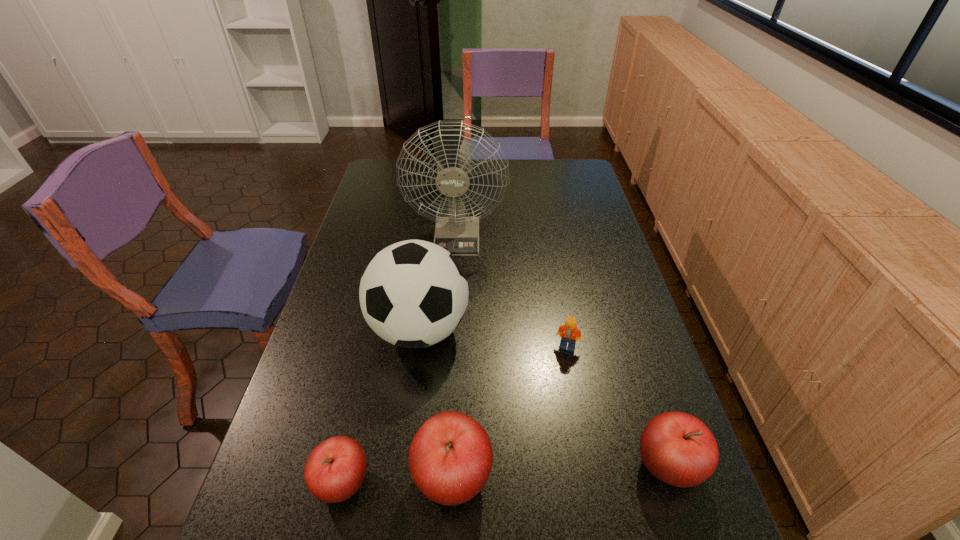
At what (x,y) coordinates should I click in order to perform the action: click on vacant point located between the soccer ball and the rightmost object. Please return your answer as a coordinate pair (x, y). Looking at the image, I should click on [543, 398].

Where is `free space between the second apple from left to right and the farthest object`? The image size is (960, 540). free space between the second apple from left to right and the farthest object is located at coordinates (455, 357).

Identify which object is the second nearest to the fifth shortest object. Please provide its 2D coordinates. Your answer should be formatted as a tuple, i.e. [(x, y)], where the tuple contains the x and y coordinates of a point satisfying the conditions above.

[(450, 458)]

I want to click on object that is the third nearest to the second tallest object, so coord(334,471).

I want to click on the second closest apple relative to the third shortest object, so click(x=334, y=471).

Select which apple appears as the third closest to the tallest object. Please provide its 2D coordinates. Your answer should be formatted as a tuple, i.e. [(x, y)], where the tuple contains the x and y coordinates of a point satisfying the conditions above.

[(334, 471)]

This screenshot has height=540, width=960. What are the coordinates of `free space that satisfies the following two spatial constraints: 1. on the back side of the second apple from left to right; 2. on the right side of the shortest apple` in the screenshot? It's located at (344, 477).

In order to click on blank space that satisfies the following two spatial constraints: 1. on the air flow direction of the tallest object; 2. on the left side of the second apple from right to left in this screenshot , I will do `click(442, 477)`.

Find the location of `free region that satisfies the following two spatial constraints: 1. on the back side of the shortest apple; 2. on the left side of the rightmost object`. free region that satisfies the following two spatial constraints: 1. on the back side of the shortest apple; 2. on the left side of the rightmost object is located at coordinates (347, 466).